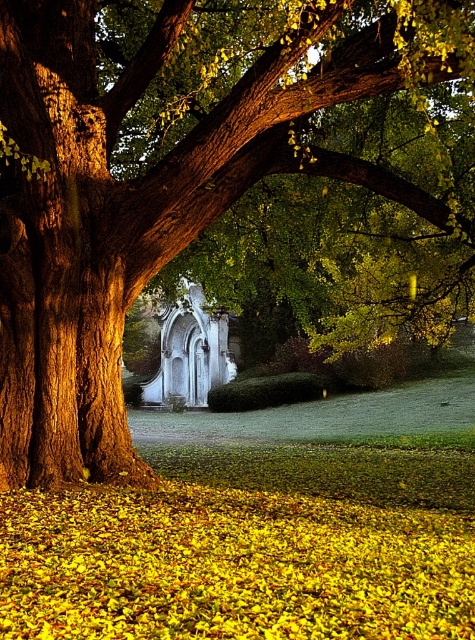
Question: Can you confirm if yellow leaf litter at ground is positioned to the right of white stone chapel at center?

Choices:
 (A) no
 (B) yes

Answer: (B)

Question: Which point is farther to the camera?

Choices:
 (A) (76, 552)
 (B) (187, 362)

Answer: (B)

Question: Can you confirm if yellow leaf litter at ground is positioned above white stone chapel at center?

Choices:
 (A) no
 (B) yes

Answer: (A)

Question: Can you confirm if yellow leaf litter at ground is wider than white stone chapel at center?

Choices:
 (A) no
 (B) yes

Answer: (B)

Question: Which point is farther from the camera taking this photo?

Choices:
 (A) (224, 582)
 (B) (161, 392)

Answer: (B)